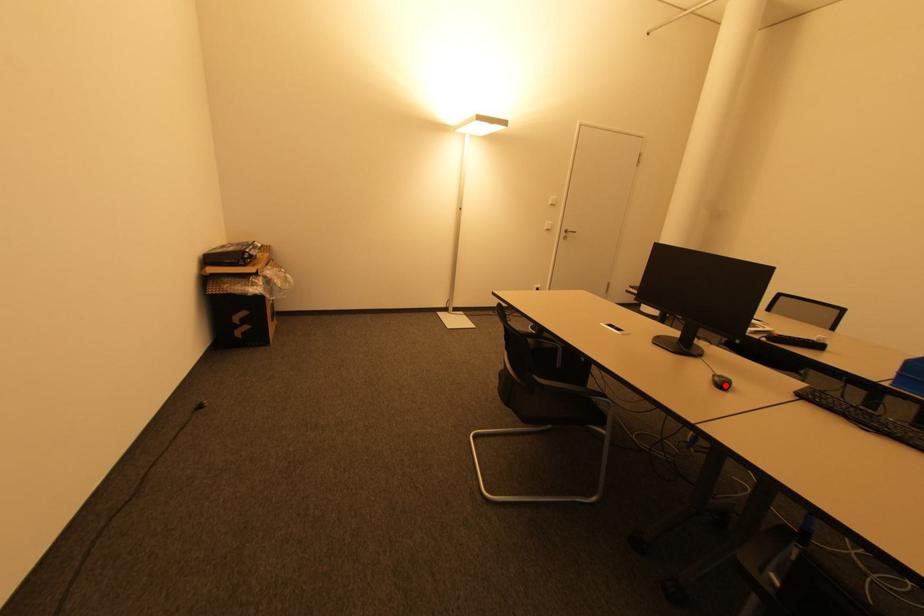
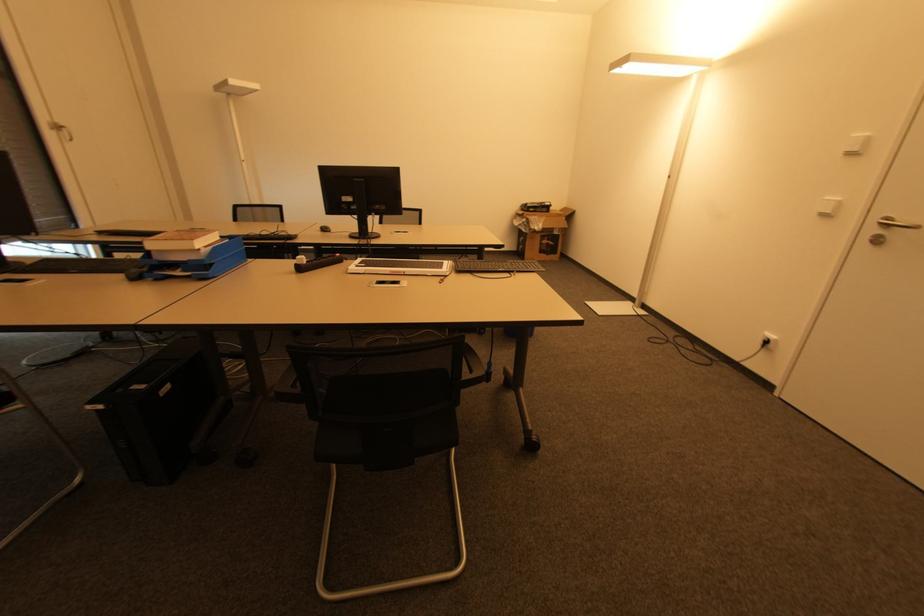
The point at the highlighted location is marked in the first image. Where is the corresponding point in the second image?

(325, 230)